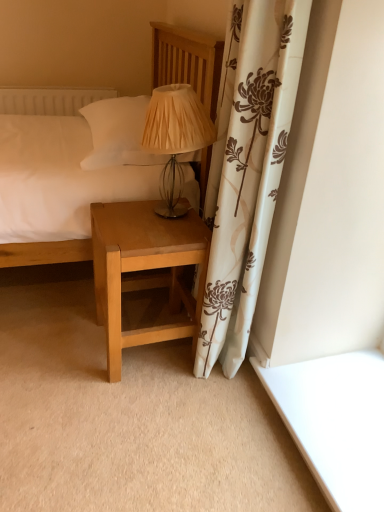
At what (x,y) coordinates should I click in order to perform the action: click on free space below matte beige fabric lampshade at center (from a real-world perspective). Please return your answer as a coordinate pair (x, y). Image resolution: width=384 pixels, height=512 pixels. Looking at the image, I should click on (169, 210).